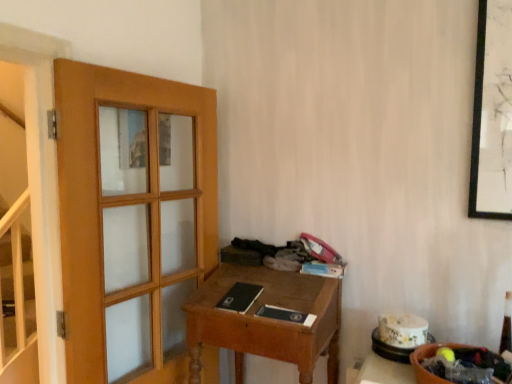
Find the location of a particular element. The image size is (512, 384). matte black book at center, which ranks as the 2th book in right-to-left order is located at coordinates (286, 315).

At what (x,y) coordinates should I click in order to perform the action: click on black matte book at center, the 3th book when ordered from right to left. Please return your answer as a coordinate pair (x, y). Looking at the image, I should click on (240, 297).

Looking at this image, is wooden desk at center facing away from black matte book at center, the 3th book when ordered from right to left?

That's not correct — wooden desk at center is not looking away from black matte book at center, the 3th book when ordered from right to left.

From the image's perspective, is wooden desk at center above or below black matte book at center, which appears as the 1th book when viewed from the left?

wooden desk at center is below black matte book at center, which appears as the 1th book when viewed from the left.

Is wooden desk at center bigger than black matte book at center, the 3th book when ordered from right to left?

Indeed, wooden desk at center has a larger size compared to black matte book at center, the 3th book when ordered from right to left.

From the picture: Which object is closer to the camera, matte black book at center, positioned as the 2th book in left-to-right order, or wooden desk at center?

wooden desk at center is more forward.

Considering the points (288, 314) and (260, 276), which point is behind, point (288, 314) or point (260, 276)?

The point (260, 276) is behind.

Considering the relative positions of matte black book at center, positioned as the 2th book in left-to-right order, and wooden desk at center in the image provided, is matte black book at center, positioned as the 2th book in left-to-right order, to the left of wooden desk at center from the viewer's perspective?

Incorrect, matte black book at center, positioned as the 2th book in left-to-right order, is not on the left side of wooden desk at center.

Can you see matte black book at center, which ranks as the 2th book in right-to-left order, touching matte blue book at center, arranged as the third book when viewed from the left?

matte black book at center, which ranks as the 2th book in right-to-left order, is not next to matte blue book at center, arranged as the third book when viewed from the left, and they're not touching.

Considering the relative positions of matte black book at center, positioned as the 2th book in left-to-right order, and matte blue book at center, arranged as the third book when viewed from the left, in the image provided, is matte black book at center, positioned as the 2th book in left-to-right order, to the right of matte blue book at center, arranged as the third book when viewed from the left, from the viewer's perspective?

No, matte black book at center, positioned as the 2th book in left-to-right order, is not to the right of matte blue book at center, arranged as the third book when viewed from the left.

Is matte blue book at center, placed as the first book when sorted from right to left, a part of matte black book at center, positioned as the 2th book in left-to-right order?

No, matte blue book at center, placed as the first book when sorted from right to left, is not inside matte black book at center, positioned as the 2th book in left-to-right order.

Who is bigger, matte black book at center, positioned as the 2th book in left-to-right order, or matte blue book at center, placed as the first book when sorted from right to left?

matte black book at center, positioned as the 2th book in left-to-right order, is bigger.

Is the surface of matte blue book at center, placed as the first book when sorted from right to left, in direct contact with black matte book at center, which appears as the 1th book when viewed from the left?

matte blue book at center, placed as the first book when sorted from right to left, and black matte book at center, which appears as the 1th book when viewed from the left, are not in contact.

Locate an element on the screen. Image resolution: width=512 pixels, height=384 pixels. book that is the 2nd object to the right of the black matte book at center, the 3th book when ordered from right to left, starting at the anchor is located at coordinates (323, 269).

Is matte blue book at center, placed as the first book when sorted from right to left, at the right side of black matte book at center, which appears as the 1th book when viewed from the left?

Correct, you'll find matte blue book at center, placed as the first book when sorted from right to left, to the right of black matte book at center, which appears as the 1th book when viewed from the left.

From a real-world perspective, is white glossy stairwell at left above or below wooden desk at center?

In terms of real-world spatial position, white glossy stairwell at left is above wooden desk at center.

Considering the relative sizes of white glossy stairwell at left and wooden desk at center in the image provided, is white glossy stairwell at left thinner than wooden desk at center?

Yes, white glossy stairwell at left is thinner than wooden desk at center.

Is white glossy stairwell at left not inside wooden desk at center?

white glossy stairwell at left is positioned outside wooden desk at center.

Is matte black book at center, positioned as the 2th book in left-to-right order, turned away from black matte book at center, the 3th book when ordered from right to left?

No, black matte book at center, the 3th book when ordered from right to left, is not at the back of matte black book at center, positioned as the 2th book in left-to-right order.

From the image's perspective, between matte black book at center, positioned as the 2th book in left-to-right order, and black matte book at center, the 3th book when ordered from right to left, who is located below?

matte black book at center, positioned as the 2th book in left-to-right order, from the image's perspective.

Between matte black book at center, positioned as the 2th book in left-to-right order, and black matte book at center, the 3th book when ordered from right to left, which one has smaller size?

Smaller between the two is matte black book at center, positioned as the 2th book in left-to-right order.

Does black matte book at center, which appears as the 1th book when viewed from the left, have a smaller size compared to matte blue book at center, arranged as the third book when viewed from the left?

No.

Does point (242, 291) come farther from viewer compared to point (338, 272)?

No, (242, 291) is closer to viewer.

From the image's perspective, between black matte book at center, the 3th book when ordered from right to left, and matte blue book at center, placed as the first book when sorted from right to left, which one is located above?

matte blue book at center, placed as the first book when sorted from right to left, appears higher in the image.

Where is `book above the black matte book at center, the 3th book when ordered from right to left (from the image's perspective)`? book above the black matte book at center, the 3th book when ordered from right to left (from the image's perspective) is located at coordinates (323, 269).

Locate an element on the screen. The height and width of the screenshot is (384, 512). the 2nd book above when counting from the wooden desk at center (from the image's perspective) is located at coordinates (240, 297).

At what (x,y) coordinates should I click in order to perform the action: click on desk to the left of matte black book at center, positioned as the 2th book in left-to-right order. Please return your answer as a coordinate pair (x, y). Looking at the image, I should click on (266, 321).

Estimate the real-world distances between objects in this image. Which object is closer to wooden desk at center, matte black book at center, which ranks as the 2th book in right-to-left order, or matte blue book at center, arranged as the third book when viewed from the left?

matte black book at center, which ranks as the 2th book in right-to-left order, is closer to wooden desk at center.

Consider the image. Estimate the real-world distances between objects in this image. Which object is closer to black matte book at center, which appears as the 1th book when viewed from the left, wooden desk at center or matte black book at center, which ranks as the 2th book in right-to-left order?

matte black book at center, which ranks as the 2th book in right-to-left order.

Which object lies nearer to the anchor point matte black book at center, positioned as the 2th book in left-to-right order, wooden desk at center or black matte book at center, the 3th book when ordered from right to left?

Based on the image, black matte book at center, the 3th book when ordered from right to left, appears to be nearer to matte black book at center, positioned as the 2th book in left-to-right order.

From the image, which object appears to be nearer to black matte book at center, the 3th book when ordered from right to left, white glossy stairwell at left or matte black book at center, positioned as the 2th book in left-to-right order?

Among the two, matte black book at center, positioned as the 2th book in left-to-right order, is located nearer to black matte book at center, the 3th book when ordered from right to left.

Consider the image. Estimate the real-world distances between objects in this image. Which object is further from wooden desk at center, matte blue book at center, placed as the first book when sorted from right to left, or matte black book at center, which ranks as the 2th book in right-to-left order?

matte blue book at center, placed as the first book when sorted from right to left.

From the image, which object appears to be nearer to wooden desk at center, white glossy stairwell at left or matte blue book at center, placed as the first book when sorted from right to left?

matte blue book at center, placed as the first book when sorted from right to left, lies closer to wooden desk at center than the other object.

Estimate the real-world distances between objects in this image. Which object is closer to matte blue book at center, arranged as the third book when viewed from the left, wooden desk at center or white glossy stairwell at left?

Based on the image, wooden desk at center appears to be nearer to matte blue book at center, arranged as the third book when viewed from the left.

Which object lies further to the anchor point matte blue book at center, arranged as the third book when viewed from the left, black matte book at center, which appears as the 1th book when viewed from the left, or wooden desk at center?

Among the two, black matte book at center, which appears as the 1th book when viewed from the left, is located further to matte blue book at center, arranged as the third book when viewed from the left.

This screenshot has height=384, width=512. Find the location of `book that lies between black matte book at center, which appears as the 1th book when viewed from the left, and wooden desk at center from top to bottom`. book that lies between black matte book at center, which appears as the 1th book when viewed from the left, and wooden desk at center from top to bottom is located at coordinates (286, 315).

The width and height of the screenshot is (512, 384). I want to click on book between white glossy stairwell at left and wooden desk at center from left to right, so click(240, 297).

This screenshot has height=384, width=512. In order to click on desk situated between white glossy stairwell at left and matte black book at center, positioned as the 2th book in left-to-right order, from left to right in this screenshot , I will do `click(266, 321)`.

Where is `book between white glossy stairwell at left and matte black book at center, which ranks as the 2th book in right-to-left order, from left to right`? The image size is (512, 384). book between white glossy stairwell at left and matte black book at center, which ranks as the 2th book in right-to-left order, from left to right is located at coordinates [240, 297].